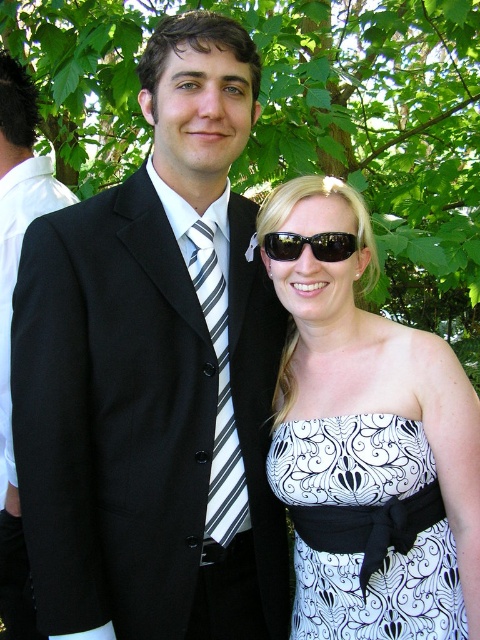
Between black suit at left and green leafy tree at upper center, which one has more height?

green leafy tree at upper center is taller.

Measure the distance between point (x=190, y=320) and camera.

Point (x=190, y=320) is 1.94 meters away from camera.

Is point (84, 208) positioned after point (264, 64)?

No, it is in front of (264, 64).

At what (x,y) coordinates should I click in order to perform the action: click on black suit at left. Please return your answer as a coordinate pair (x, y). The width and height of the screenshot is (480, 640). Looking at the image, I should click on (156, 374).

Can you confirm if white printed dress at center is shorter than white printed fabric dress at center?

In fact, white printed dress at center may be taller than white printed fabric dress at center.

Which is below, white printed dress at center or white printed fabric dress at center?

white printed fabric dress at center is lower down.

Between point (369, 509) and point (408, 632), which one is positioned in front?

Point (408, 632) is more forward.

Identify the location of white printed dress at center. (369, 445).

Between black satin suit at left and striped fabric tie at center, which one appears on the left side from the viewer's perspective?

Positioned to the left is black satin suit at left.

Is black satin suit at left below striped fabric tie at center?

Actually, black satin suit at left is above striped fabric tie at center.

Locate an element on the screen. black satin suit at left is located at coordinates (11, 316).